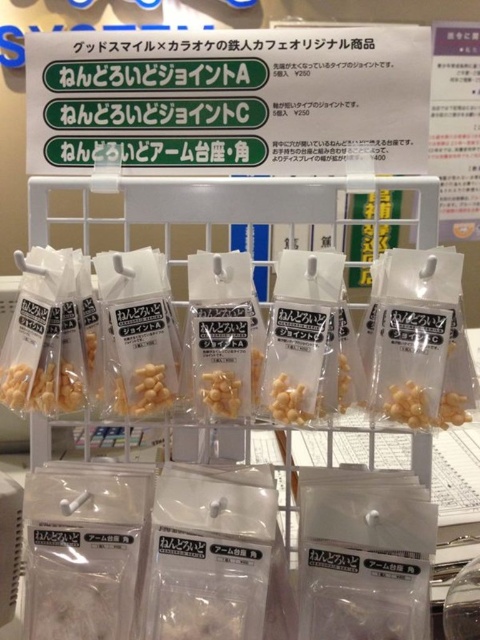
Does white plastic sign at upper center have a larger size compared to yellow matte joint at center?

Correct, white plastic sign at upper center is larger in size than yellow matte joint at center.

Between white plastic sign at upper center and yellow matte joint at center, which one has less height?

Standing shorter between the two is yellow matte joint at center.

Identify the location of white plastic sign at upper center. The image size is (480, 640). (229, 99).

Identify the location of white plastic sign at upper center. The width and height of the screenshot is (480, 640). (229, 99).

Which is more to the left, translucent plastic nuts at center or yellow matte joint at center?

From the viewer's perspective, yellow matte joint at center appears more on the left side.

Does translucent plastic nuts at center lie in front of yellow matte joint at center?

Yes, translucent plastic nuts at center is in front of yellow matte joint at center.

The width and height of the screenshot is (480, 640). What do you see at coordinates (423, 406) in the screenshot? I see `translucent plastic nuts at center` at bounding box center [423, 406].

Locate an element on the screen. The height and width of the screenshot is (640, 480). translucent plastic nuts at center is located at coordinates (423, 406).

Between white plastic sign at upper center and translucent plastic nuts at center, which one has less height?

With less height is translucent plastic nuts at center.

Locate an element on the screen. This screenshot has height=640, width=480. white plastic sign at upper center is located at coordinates (229, 99).